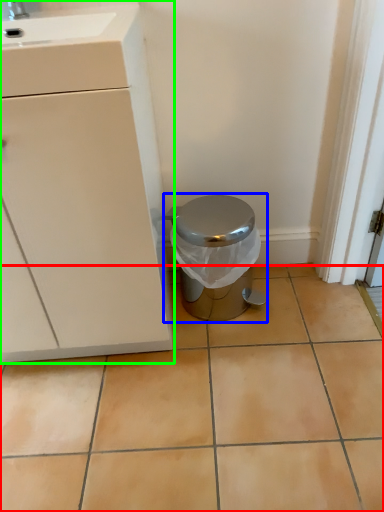
Question: Which object is the farthest from ceramic tile (highlighted by a red box)? Choose among these: waste container (highlighted by a blue box) or cabinetry (highlighted by a green box).

Choices:
 (A) waste container
 (B) cabinetry

Answer: (B)